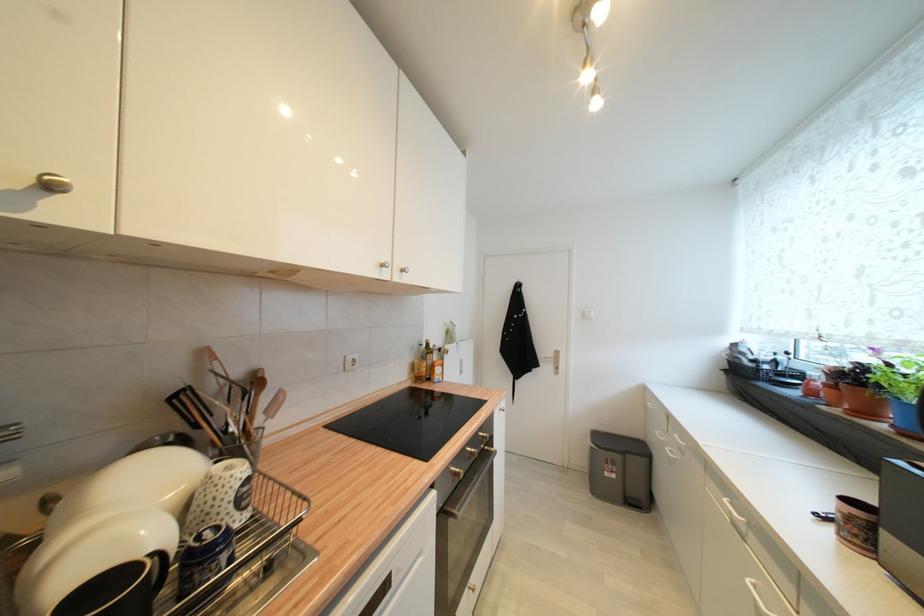
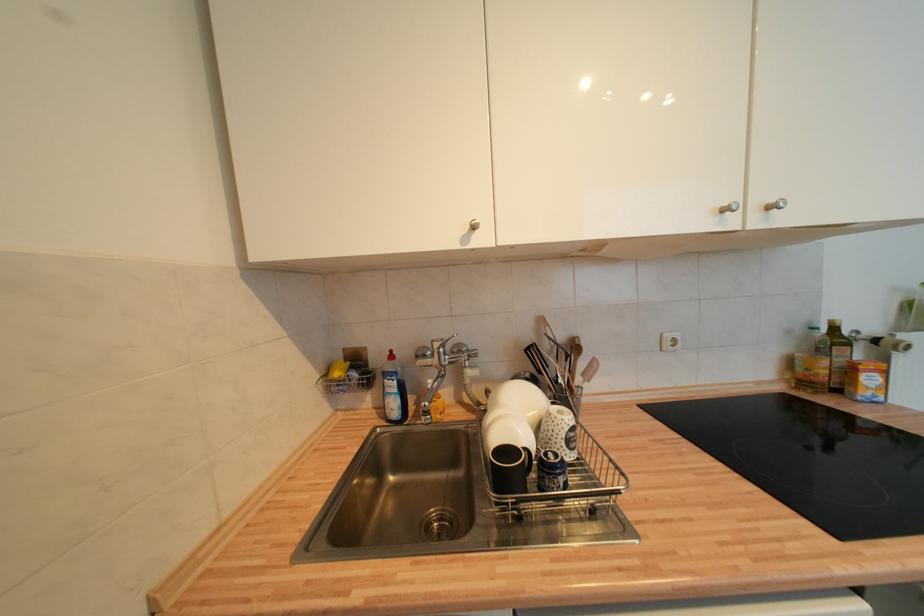
Where in the second image is the point corresponding to the point at 407,273 from the first image?

(775, 209)